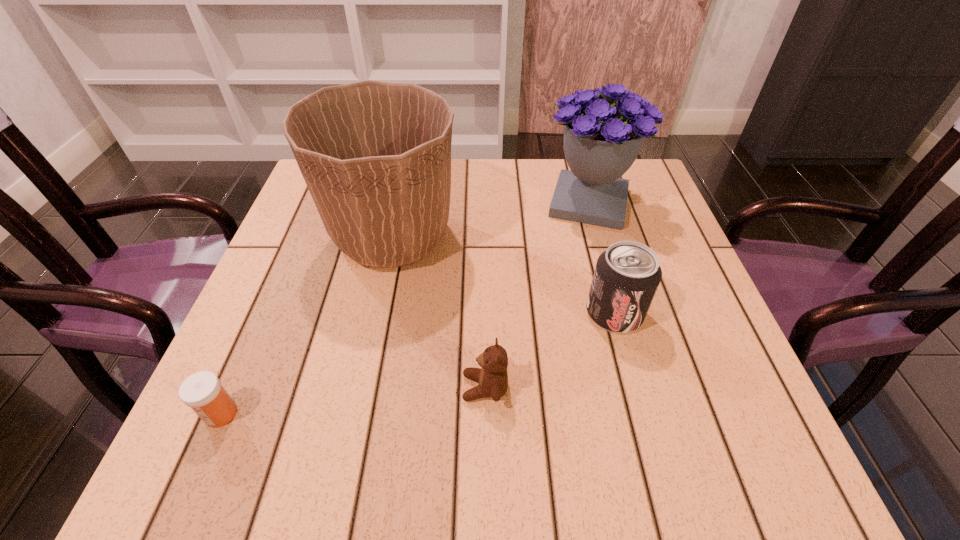
The height and width of the screenshot is (540, 960). Find the location of `bouquet that is at the right edge`. bouquet that is at the right edge is located at coordinates (601, 141).

Locate an element on the screen. This screenshot has height=540, width=960. soda can at the right edge is located at coordinates (626, 277).

I want to click on object present at the far left corner, so click(376, 156).

Identify the location of object located in the near left corner section of the desktop. (202, 391).

This screenshot has width=960, height=540. Identify the location of object that is at the far right corner. (601, 141).

Image resolution: width=960 pixels, height=540 pixels. Identify the location of vacant space at the far edge. (527, 170).

This screenshot has height=540, width=960. In order to click on vacant space at the near edge of the desktop in this screenshot , I will do `click(417, 444)`.

Locate an element on the screen. blank space at the left edge is located at coordinates tap(301, 323).

I want to click on free space at the right edge of the desktop, so (666, 225).

In the image, there is a desktop. At what (x,y) coordinates should I click in order to perform the action: click on vacant area at the far right corner. Please return your answer as a coordinate pair (x, y). The image size is (960, 540). Looking at the image, I should click on (652, 213).